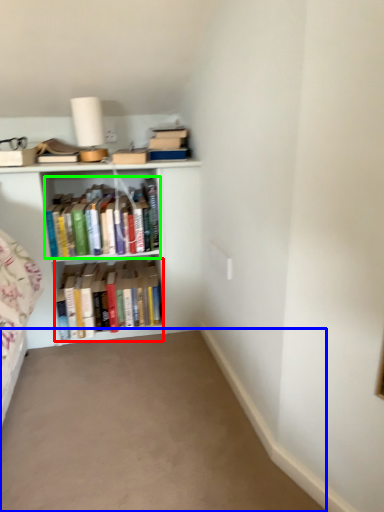
Question: Which is farther away from book (highlighted by a red box)? plain (highlighted by a blue box) or book (highlighted by a green box)?

Choices:
 (A) plain
 (B) book

Answer: (A)